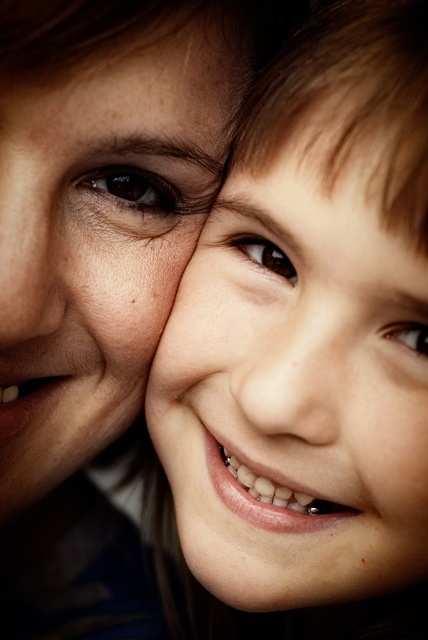
The smooth skin face at center is located at what coordinates?

The smooth skin face at center is located at coordinates point (x=309, y=330).

Based on the photo, you are a photographer trying to capture the perfect shot of the two eyes in the image. You want to ensure both the brown glossy eye at center and the brown glossy eye at upper right are in focus. Which eye should you focus on to make sure both are sharp?

The brown glossy eye at upper right is behind the brown glossy eye at center, so focusing on the brown glossy eye at center will ensure both are sharp as the one behind will still be in focus range.

In the scene shown: Looking at the image of the mother and child, which object has a larger size between the smooth skin face at center and the smooth skin nose at center?

The smooth skin face at center is bigger than the smooth skin nose at center.